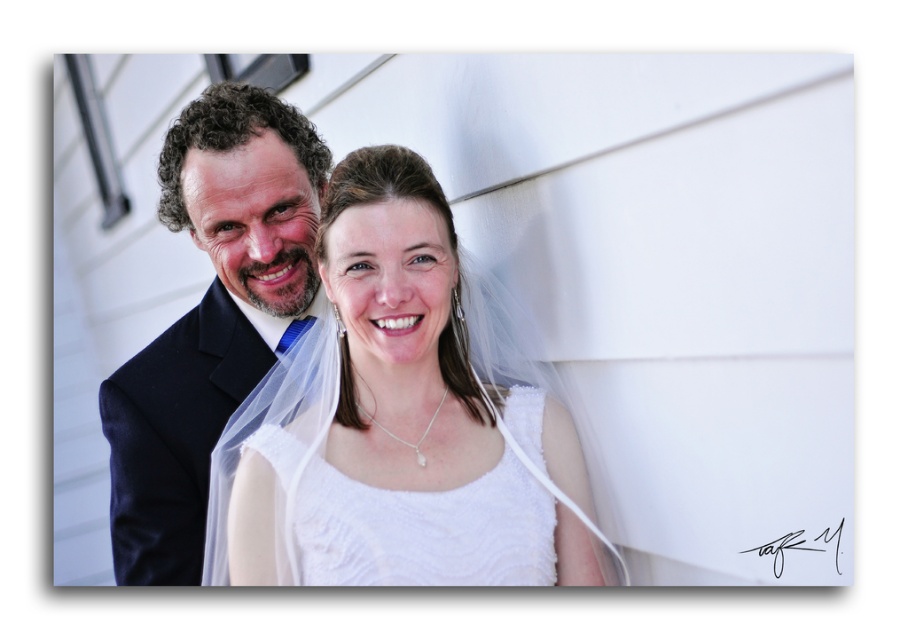
You are a photographer at a wedding. You need to decide which part of the bride to focus on for a closeup shot. The white lace dress at center and the white textured fabric at center are both visible. Which one is larger and would be easier to capture in a clear shot?

The white lace dress at center is bigger than the white textured fabric at center, so it would be easier to capture in a clear shot.

What is located at the coordinates point (398,424) in the image?

The white lace dress at center is located at point (398,424).

You are a photographer setting up for a wedding photo. You have to focus on both the dark blue suit at left and the white textured fabric at center. Which one should you adjust your camera focus to first if you want to ensure both are in focus, considering their sizes?

The dark blue suit at left has a larger size compared to white textured fabric at center, so you should focus on the dark blue suit at left first to ensure both are in focus.